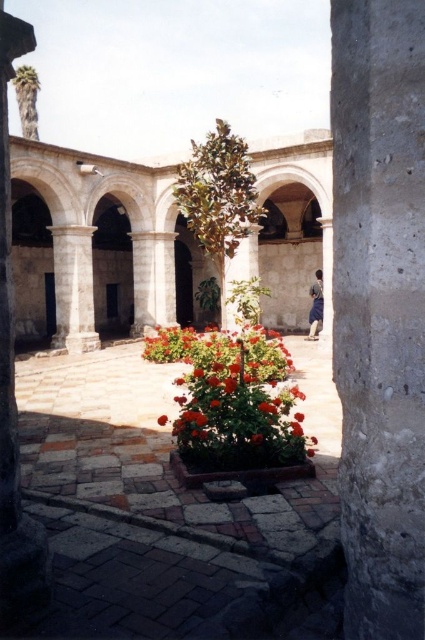
Question: Is gray concrete pillar at center to the left of brown fabric person at center from the viewer's perspective?

Choices:
 (A) yes
 (B) no

Answer: (A)

Question: Which of the following is the closest to the observer?

Choices:
 (A) (407, 198)
 (B) (158, 417)
 (C) (278, 353)

Answer: (A)

Question: Is smooth stone pillar at left smaller than red matte flower at center?

Choices:
 (A) yes
 (B) no

Answer: (B)

Question: Is gray concrete pillar at center closer to the viewer compared to smooth stone pillar at left?

Choices:
 (A) yes
 (B) no

Answer: (A)

Question: Which of these objects is positioned closest to the smooth stone pillar at left?

Choices:
 (A) brown fabric person at center
 (B) glossy ceramic flower bed at center
 (C) gray concrete pillar at center
 (D) red matte flower at center

Answer: (D)

Question: Which object appears farthest from the camera in this image?

Choices:
 (A) gray concrete pillar at center
 (B) glossy ceramic flower bed at center

Answer: (B)